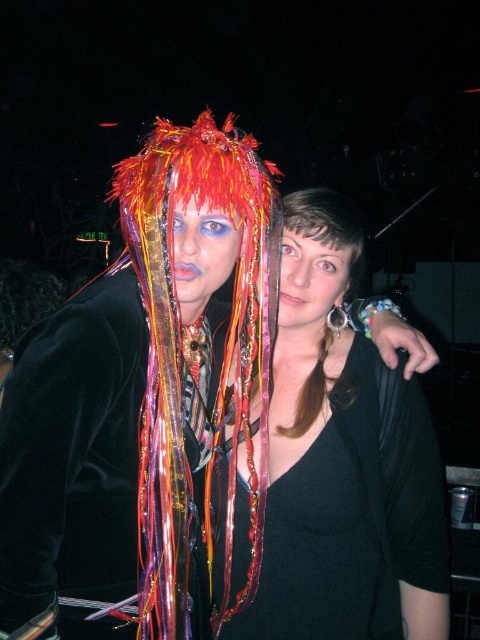
You are at a party and want to take a photo with both the shiny metallic face at center and the matte black face at center in the frame. Which one should you position closer to the camera to ensure both faces are visible?

You should position the shiny metallic face at center closer to the camera because it is to the left of the matte black face at center, so adjusting their positions can help ensure both faces are in the frame.

You are a photographer at a party. You need to frame a photo where both the shiny metallic face at center and the matte black face at center are visible. Which face will appear smaller in the frame?

The shiny metallic face at center has a lesser width compared to the matte black face at center, so it will appear smaller in the frame.